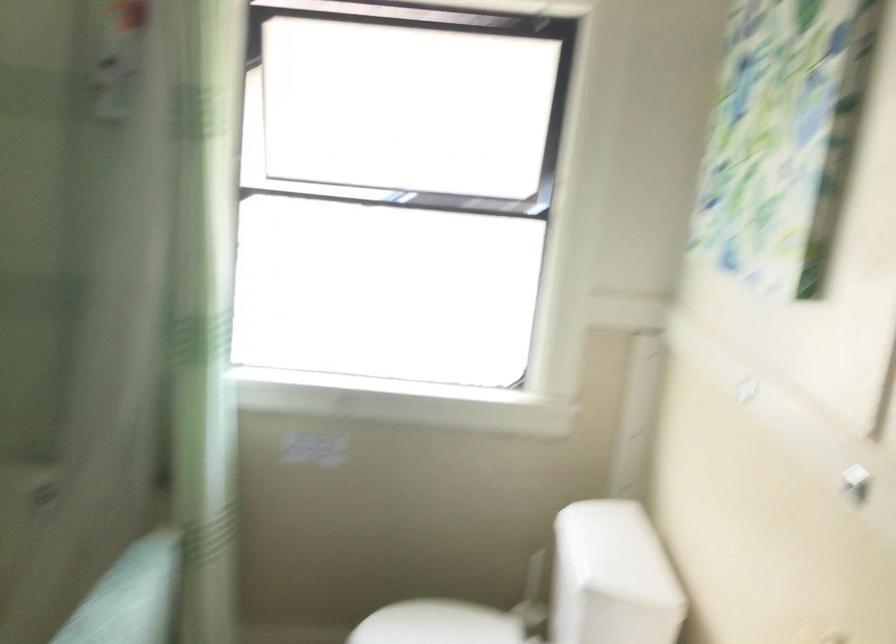
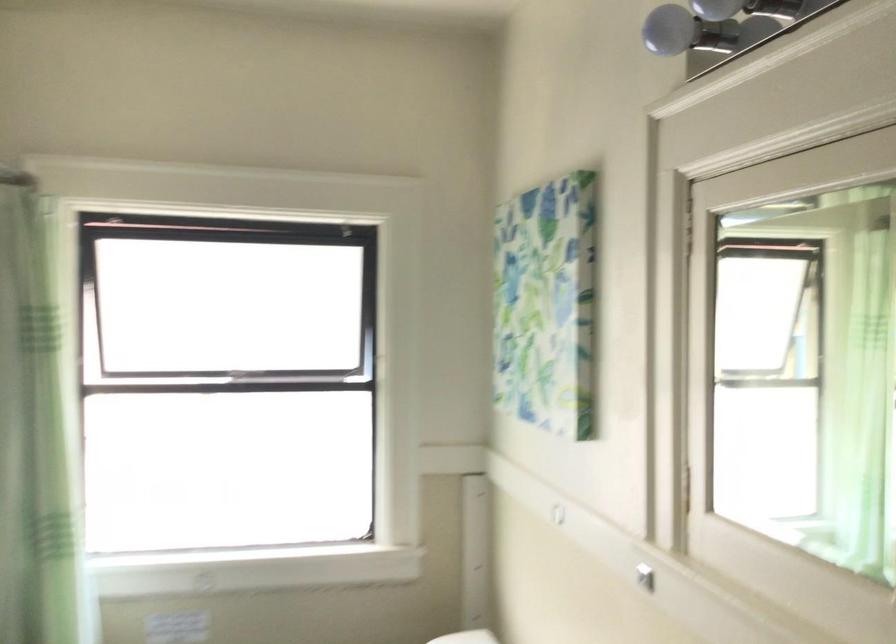
Question: What movement of the cameraman would produce the second image?

Choices:
 (A) Left
 (B) Right
 (C) Forward
 (D) Backward

Answer: (D)